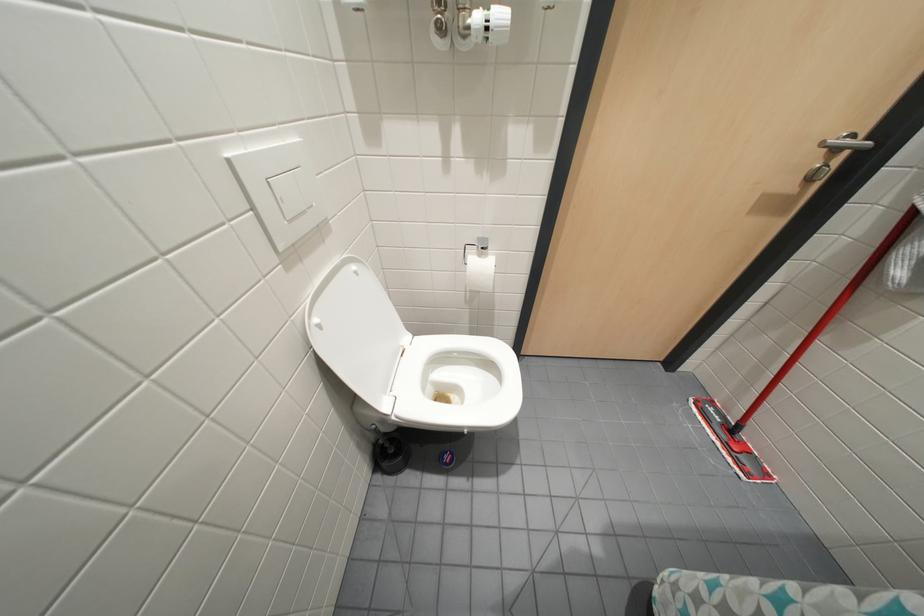
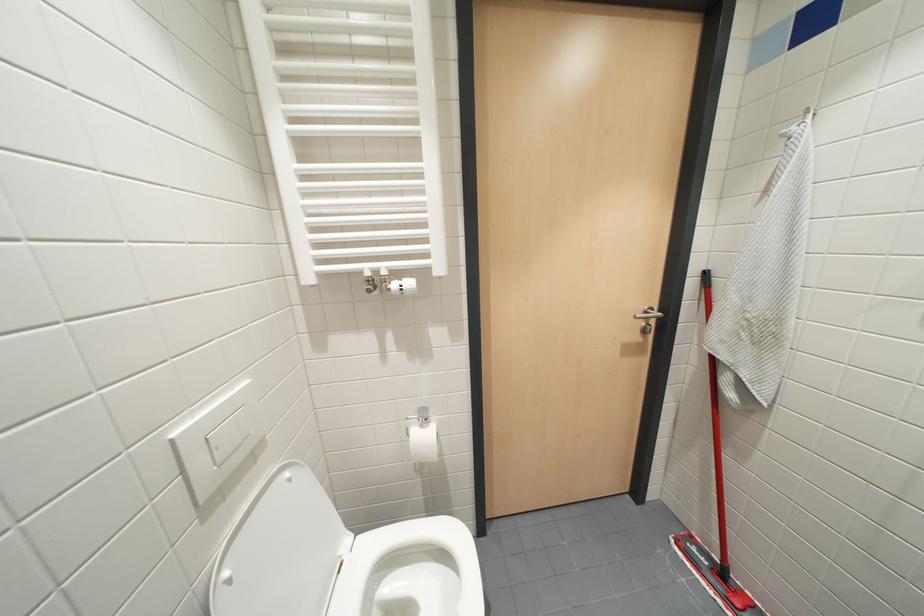
Question: How did the camera likely rotate?

Choices:
 (A) Left
 (B) Right
 (C) Up
 (D) Down

Answer: (C)